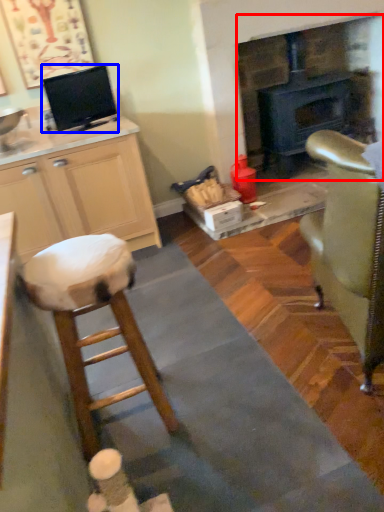
Question: Which of the following is the farthest to the observer, fireplace (highlighted by a red box) or appliance (highlighted by a blue box)?

Choices:
 (A) fireplace
 (B) appliance

Answer: (A)